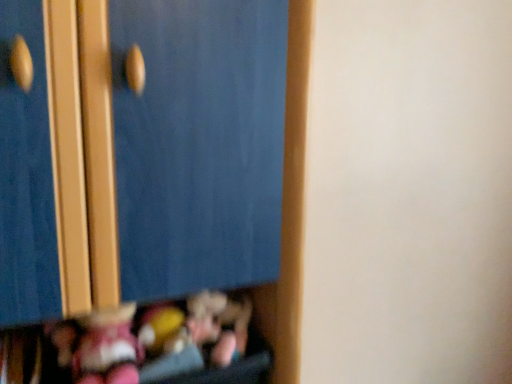
Image resolution: width=512 pixels, height=384 pixels. What do you see at coordinates (219, 324) in the screenshot?
I see `plush pink doll at lower center` at bounding box center [219, 324].

This screenshot has width=512, height=384. Identify the location of plush pink doll at lower center. (219, 324).

The width and height of the screenshot is (512, 384). I want to click on plush pink doll at lower center, so click(x=219, y=324).